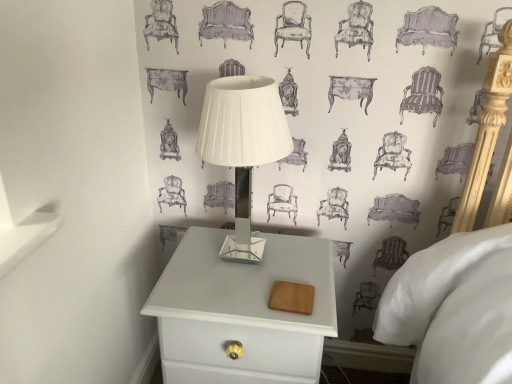
The height and width of the screenshot is (384, 512). What are the coordinates of `vacant region to the left of white glossy table lamp at center` in the screenshot? It's located at (185, 258).